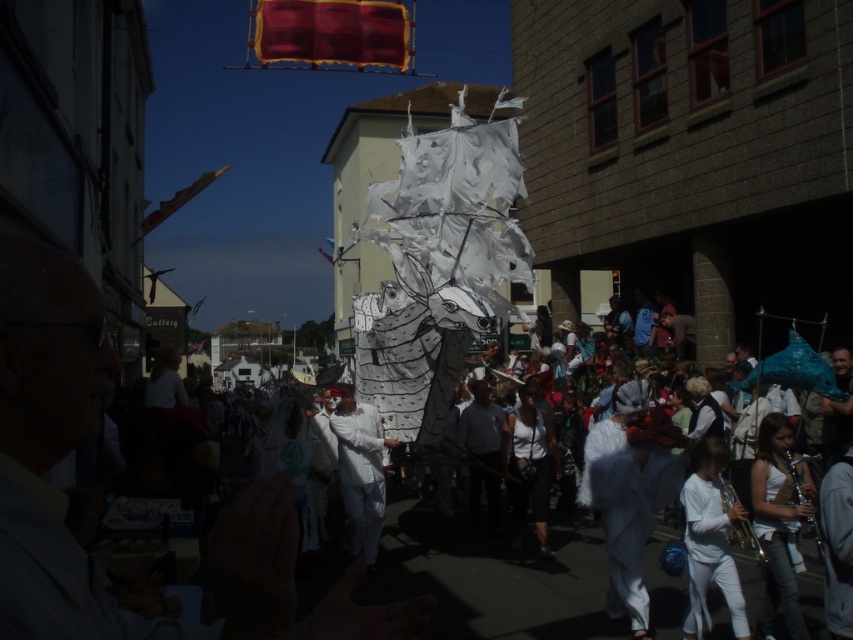
Does white paper mask at center have a smaller size compared to white paper ship at center?

No, white paper mask at center is not smaller than white paper ship at center.

Is point (428, 604) positioned after point (474, 461)?

No, it is not.

Locate an element on the screen. The width and height of the screenshot is (853, 640). white paper mask at center is located at coordinates click(50, 445).

Between white paper dragon at center and white paper ship at center, which one appears on the left side from the viewer's perspective?

white paper dragon at center is more to the left.

Which of these two, white paper dragon at center or white paper ship at center, stands shorter?

Standing shorter between the two is white paper ship at center.

Locate an element on the screen. This screenshot has width=853, height=640. white paper dragon at center is located at coordinates (360, 468).

Measure the distance between point (242, 520) and camera.

Point (242, 520) and camera are 17.57 meters apart from each other.

In the scene shown: Who is taller, white paper mask at center or white paper dragon at center?

white paper mask at center

Who is more distant from viewer, (26, 412) or (367, 563)?

The point (367, 563) is more distant.

Locate an element on the screen. This screenshot has height=640, width=853. white paper mask at center is located at coordinates (50, 445).